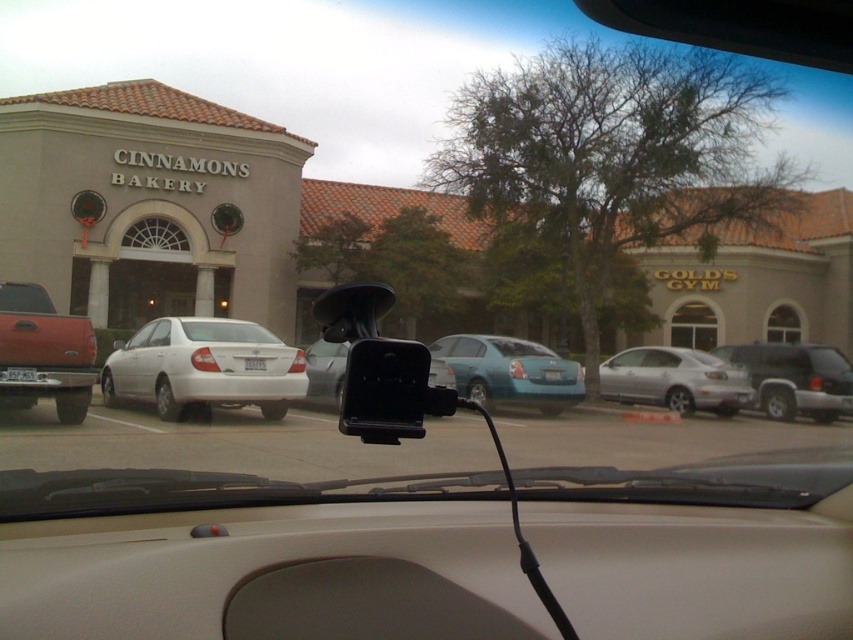
Question: Does white matte sedan at center appear under black plastic view mirror at center?

Choices:
 (A) no
 (B) yes

Answer: (B)

Question: Considering the real-world distances, which object is closest to the matte red truck at left?

Choices:
 (A) silver metallic suv at right
 (B) black plastic view mirror at center
 (C) white matte sedan at center
 (D) silver metallic sedan at center

Answer: (C)

Question: Is matte red truck at left closer to the viewer compared to teal matte sedan at center?

Choices:
 (A) yes
 (B) no

Answer: (A)

Question: Can you confirm if white matte sedan at center is bigger than silver metallic sedan at center?

Choices:
 (A) no
 (B) yes

Answer: (A)

Question: Which point appears farthest from the camera in this image?

Choices:
 (A) (73, 369)
 (B) (436, 356)
 (C) (375, 388)
 (D) (701, 362)

Answer: (D)

Question: Which of the following is the farthest from the observer?

Choices:
 (A) satin black camera at center
 (B) teal matte sedan at center
 (C) black plastic view mirror at center

Answer: (B)